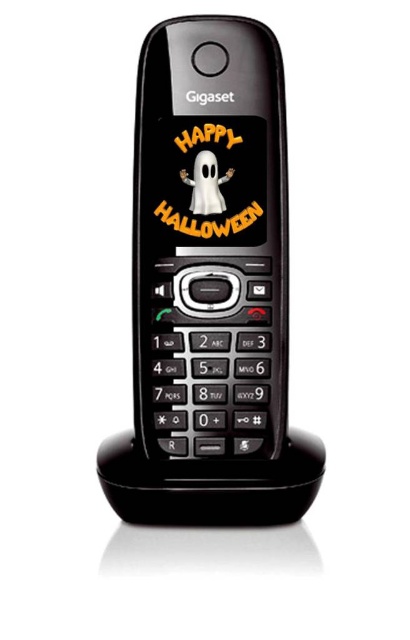
You are looking at the Gigaset telephone in the image. There are two points marked on it, one at coordinate point (150, 237) and another at point (205, 166). Which of these points is closer to you?

Point (150, 237) is closer to the viewer than point (205, 166).